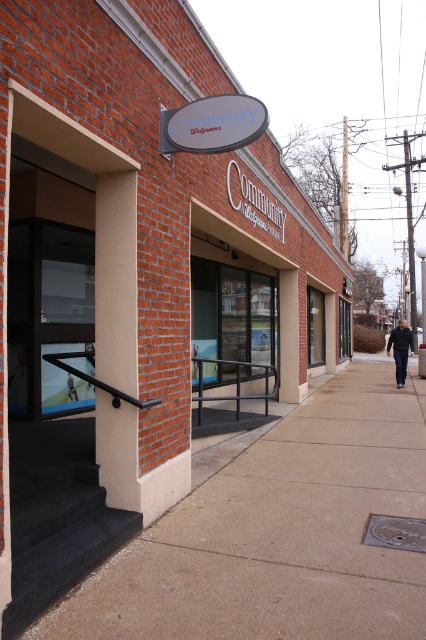
Does brown concrete sidewalk at lower left come behind dark blue jeans at center?

That is False.

Can you confirm if brown concrete sidewalk at lower left is smaller than dark blue jeans at center?

Yes, brown concrete sidewalk at lower left is smaller than dark blue jeans at center.

Identify the location of brown concrete sidewalk at lower left. (279, 532).

I want to click on brown concrete sidewalk at lower left, so click(x=279, y=532).